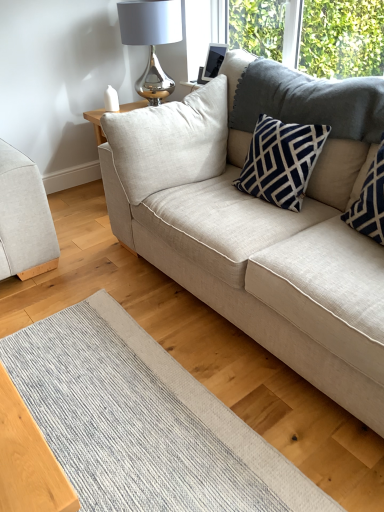
Question: From the image's perspective, is navy blue textured pillow at upper right, placed as the 1th pillow when sorted from right to left, on top of beige fabric couch at center, acting as the 2th studio couch starting from the left?

Choices:
 (A) yes
 (B) no

Answer: (B)

Question: Is navy blue textured pillow at upper right, placed as the 1th pillow when sorted from right to left, not inside beige fabric couch at center, acting as the 2th studio couch starting from the left?

Choices:
 (A) yes
 (B) no

Answer: (B)

Question: Is navy blue textured pillow at upper right, placed as the 1th pillow when sorted from right to left, thinner than beige fabric couch at center, acting as the 2th studio couch starting from the left?

Choices:
 (A) yes
 (B) no

Answer: (A)

Question: Considering the relative positions of navy blue textured pillow at upper right, placed as the 1th pillow when sorted from right to left, and beige fabric couch at center, acting as the 2th studio couch starting from the left, in the image provided, is navy blue textured pillow at upper right, placed as the 1th pillow when sorted from right to left, to the right of beige fabric couch at center, acting as the 2th studio couch starting from the left, from the viewer's perspective?

Choices:
 (A) yes
 (B) no

Answer: (A)

Question: Is navy blue textured pillow at upper right, positioned as the second pillow in left-to-right order, looking in the opposite direction of beige fabric couch at center, which is the 1th studio couch from right to left?

Choices:
 (A) yes
 (B) no

Answer: (A)

Question: Can beige fabric couch at center, which is the 1th studio couch from right to left, be found inside navy blue textured pillow at upper right, placed as the 1th pillow when sorted from right to left?

Choices:
 (A) no
 (B) yes

Answer: (A)

Question: Is beige fabric couch at center, acting as the 2th studio couch starting from the left, at the right side of beige fabric couch at left, which is counted as the first studio couch, starting from the left?

Choices:
 (A) no
 (B) yes

Answer: (B)

Question: Is beige fabric couch at center, acting as the 2th studio couch starting from the left, completely or partially outside of beige fabric couch at left, which is the 2th studio couch in right-to-left order?

Choices:
 (A) yes
 (B) no

Answer: (A)

Question: Would you consider beige fabric couch at center, acting as the 2th studio couch starting from the left, to be distant from beige fabric couch at left, which is counted as the first studio couch, starting from the left?

Choices:
 (A) no
 (B) yes

Answer: (A)

Question: From a real-world perspective, is beige fabric couch at center, which is the 1th studio couch from right to left, over beige fabric couch at left, which is counted as the first studio couch, starting from the left?

Choices:
 (A) no
 (B) yes

Answer: (A)

Question: Does beige fabric couch at center, acting as the 2th studio couch starting from the left, appear on the left side of beige fabric couch at left, which is the 2th studio couch in right-to-left order?

Choices:
 (A) no
 (B) yes

Answer: (A)

Question: Is beige fabric couch at center, acting as the 2th studio couch starting from the left, positioned behind beige fabric couch at left, which is counted as the first studio couch, starting from the left?

Choices:
 (A) no
 (B) yes

Answer: (A)

Question: Is navy blue textured pillow at upper right, positioned as the second pillow in left-to-right order, facing away from navy blue textured pillow at upper right, marked as the second pillow in a right-to-left arrangement?

Choices:
 (A) yes
 (B) no

Answer: (B)